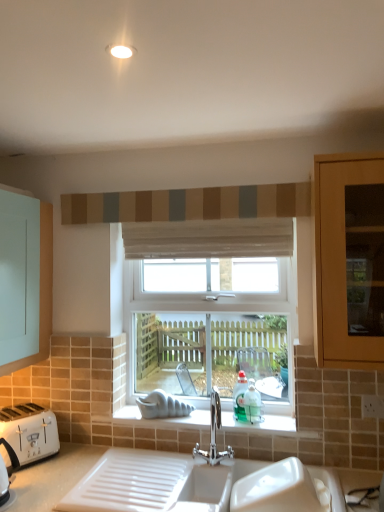
Question: From a real-world perspective, is polished chrome tap at center physically above clear glass window at center?

Choices:
 (A) no
 (B) yes

Answer: (A)

Question: Is polished chrome tap at center smaller than clear glass window at center?

Choices:
 (A) no
 (B) yes

Answer: (B)

Question: Can you confirm if polished chrome tap at center is positioned to the left of clear glass window at center?

Choices:
 (A) no
 (B) yes

Answer: (A)

Question: Is polished chrome tap at center next to clear glass window at center?

Choices:
 (A) no
 (B) yes

Answer: (A)

Question: From the image's perspective, is polished chrome tap at center under clear glass window at center?

Choices:
 (A) yes
 (B) no

Answer: (A)

Question: Considering the relative sizes of polished chrome tap at center and clear glass window at center in the image provided, is polished chrome tap at center shorter than clear glass window at center?

Choices:
 (A) no
 (B) yes

Answer: (B)

Question: Does white sheer curtain at center, which is counted as the 1th curtain, starting from the bottom, appear on the right side of teal glass bottle at window?

Choices:
 (A) no
 (B) yes

Answer: (A)

Question: Does white sheer curtain at center, which is counted as the 2th curtain, starting from the top, have a smaller size compared to teal glass bottle at window?

Choices:
 (A) no
 (B) yes

Answer: (A)

Question: Is white sheer curtain at center, which is counted as the 2th curtain, starting from the top, aimed at teal glass bottle at window?

Choices:
 (A) no
 (B) yes

Answer: (A)

Question: Can you confirm if white sheer curtain at center, which is counted as the 2th curtain, starting from the top, is taller than teal glass bottle at window?

Choices:
 (A) yes
 (B) no

Answer: (B)

Question: Is white sheer curtain at center, which is counted as the 1th curtain, starting from the bottom, closer to camera compared to teal glass bottle at window?

Choices:
 (A) yes
 (B) no

Answer: (B)

Question: From a real-world perspective, is white sheer curtain at center, which is counted as the 1th curtain, starting from the bottom, positioned over teal glass bottle at window based on gravity?

Choices:
 (A) yes
 (B) no

Answer: (A)

Question: Does textured fabric curtain at upper center, which is counted as the 1th curtain, starting from the top, have a greater width compared to polished chrome tap at center?

Choices:
 (A) yes
 (B) no

Answer: (B)